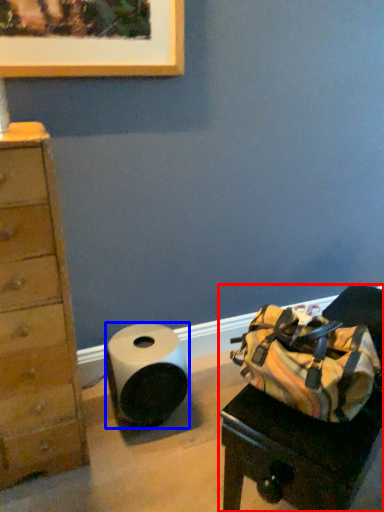
Question: Which point is further to the camera, furniture (highlighted by a red box) or paper towel (highlighted by a blue box)?

Choices:
 (A) furniture
 (B) paper towel

Answer: (B)